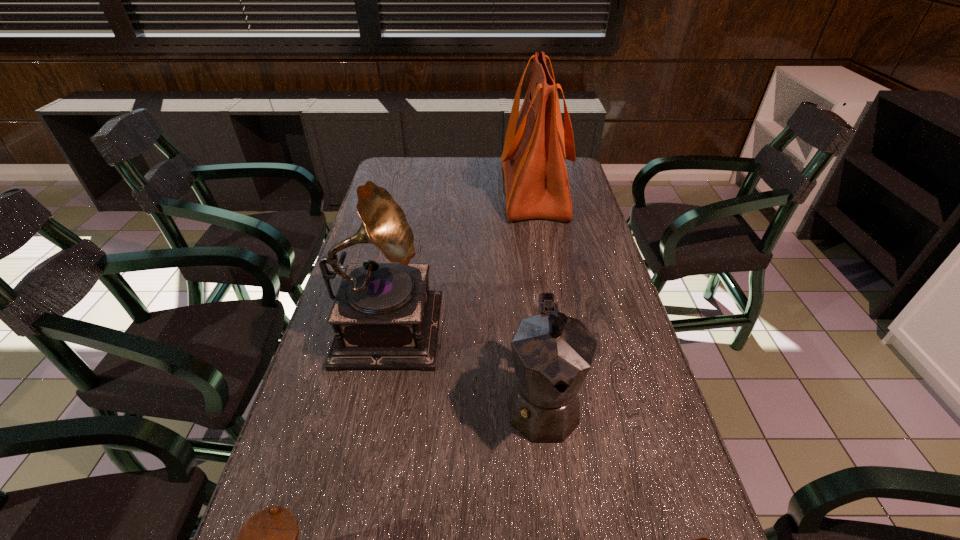
You are a GUI agent. You are given a task and a screenshot of the screen. Output one action in this format:
    pyautogui.click(x=<x>, y=<y>)
    Task: Click on the object that is the fourth nearest to the record player
    The width and height of the screenshot is (960, 540).
    Given the screenshot: What is the action you would take?
    pyautogui.click(x=704, y=539)

Find the location of a particular element. free spot that satisfies the following two spatial constraints: 1. on the front pocket of the shopping bag; 2. on the pouring side of the coffeepot is located at coordinates (572, 404).

I want to click on vacant area in the image that satisfies the following two spatial constraints: 1. on the front pocket of the shopping bag; 2. on the pouring side of the third shortest object, so click(x=572, y=404).